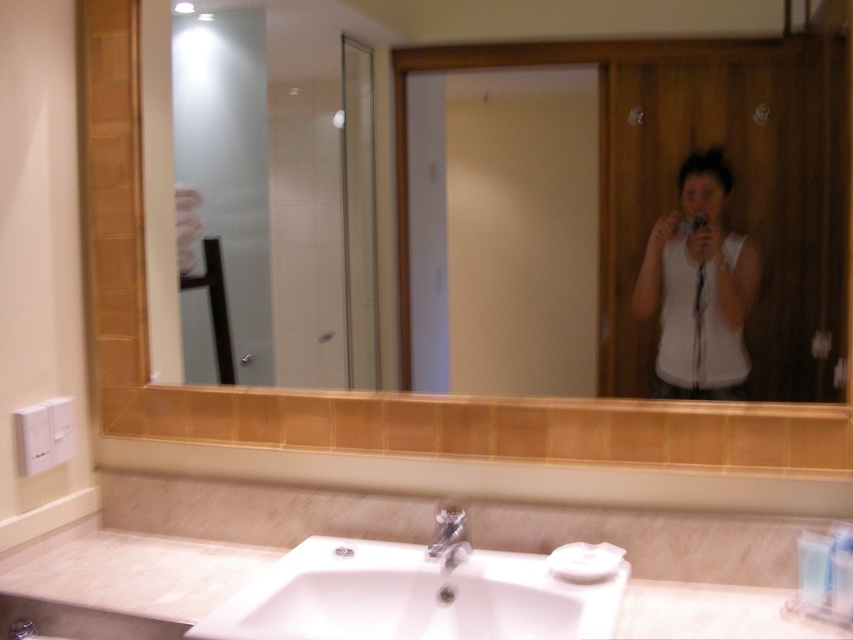
You are a contractor measuring the bathroom layout. The wooden frame mirror at upper center and the satin nickel faucet at sink center are two fixtures you need to install. If the recommended minimum distance between these two fixtures is 24 inches for safety, is the current spacing compliant with the safety guideline?

The distance between the wooden frame mirror at upper center and the satin nickel faucet at sink center is 27.08 inches, which exceeds the recommended minimum of 24 inches. Therefore, the current spacing complies with the safety guideline.

You are trying to place a decorative item on the bathroom counter between the white glossy sink at lower center and the wooden frame mirror at upper center. Is there enough vertical space between them to place it?

The wooden frame mirror at upper center is located above the white glossy sink at lower center, but the exact vertical distance isn not specified. Without knowing the height difference, it is impossible to determine if there is enough space to place the decorative item between them.